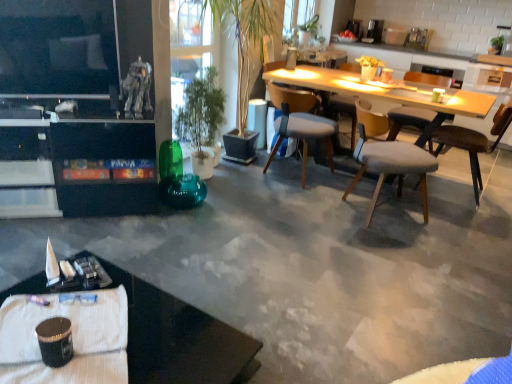
Find the location of a particular element. vacant space underneath white textured tablecloth at lower left (from a real-world perspective) is located at coordinates (74, 321).